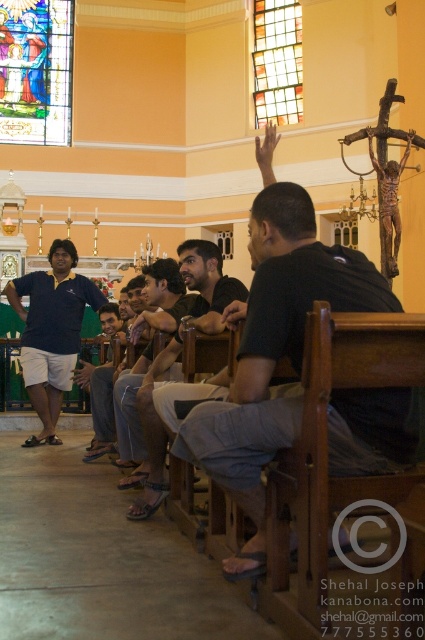
Does dark gray fabric shirt at center have a larger size compared to matte blue shirt at left?

Actually, dark gray fabric shirt at center might be smaller than matte blue shirt at left.

Looking at this image, does dark gray fabric shirt at center appear over matte blue shirt at left?

Yes.

You are a GUI agent. You are given a task and a screenshot of the screen. Output one action in this format:
    pyautogui.click(x=<x>, y=<y>)
    Task: Click on the dark gray fabric shirt at center
    Image resolution: width=425 pixels, height=640 pixels.
    Given the screenshot: What is the action you would take?
    pyautogui.click(x=274, y=353)

Between matte blue shirt at left and translucent stained glass at upper center, which one appears on the left side from the viewer's perspective?

matte blue shirt at left is more to the left.

Which of these two, matte blue shirt at left or translucent stained glass at upper center, stands shorter?

matte blue shirt at left

Who is more distant from viewer, (57, 280) or (255, 51)?

The point (255, 51) is behind.

Locate an element on the screen. Image resolution: width=425 pixels, height=640 pixels. matte blue shirt at left is located at coordinates (51, 332).

The image size is (425, 640). Find the location of `matte blue shirt at left`. matte blue shirt at left is located at coordinates (51, 332).

Find the location of a particular element. The image size is (425, 640). matte blue shirt at left is located at coordinates (51, 332).